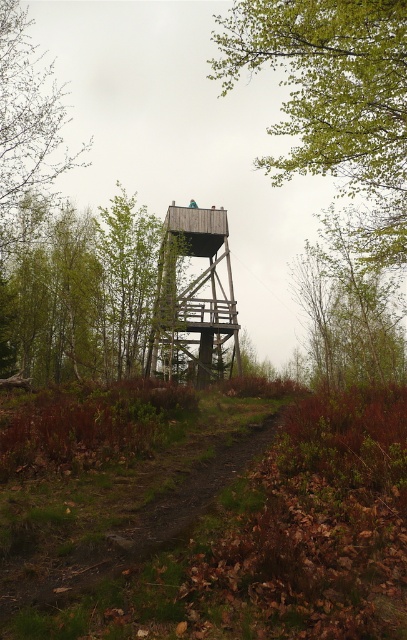
Does point (19, 528) come behind point (221, 211)?

No.

From the picture: Is brown dirt path at center above wooden platform at center?

Incorrect, brown dirt path at center is not positioned above wooden platform at center.

Does point (91, 504) come farther from viewer compared to point (181, 320)?

No, it is not.

Identify the location of brown dirt path at center. click(118, 509).

Is point (249, 12) positioned after point (214, 369)?

No, (249, 12) is in front of (214, 369).

Is green leafy tree at upper center positioned before wooden platform at center?

That is True.

At what (x,y) coordinates should I click in order to perform the action: click on green leafy tree at upper center. Please return your answer as a coordinate pair (x, y). Looking at the image, I should click on (334, 99).

Which is more to the left, green leafy tree at upper center or brown dirt path at center?

Positioned to the left is brown dirt path at center.

Is green leafy tree at upper center thinner than brown dirt path at center?

Incorrect, green leafy tree at upper center's width is not less than brown dirt path at center's.

Which is in front, point (358, 74) or point (177, 477)?

Point (177, 477) is more forward.

Image resolution: width=407 pixels, height=640 pixels. I want to click on green leafy tree at upper center, so click(334, 99).